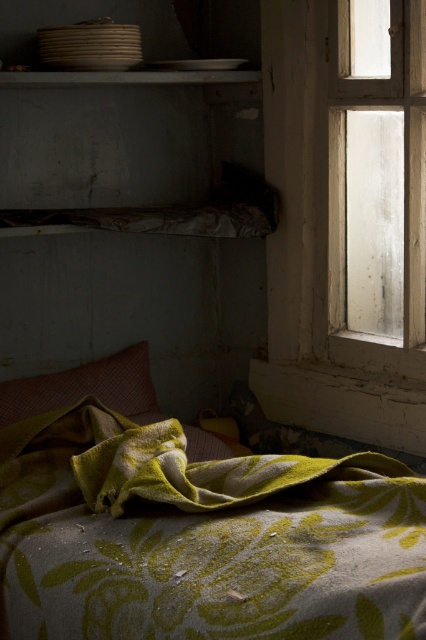
Is floral-patterned fabric at lower center to the right of red plaid pillow at center from the viewer's perspective?

Indeed, floral-patterned fabric at lower center is positioned on the right side of red plaid pillow at center.

From the picture: Is floral-patterned fabric at lower center thinner than red plaid pillow at center?

In fact, floral-patterned fabric at lower center might be wider than red plaid pillow at center.

Does point (356, 634) lie in front of point (40, 397)?

Yes, point (356, 634) is in front of point (40, 397).

The height and width of the screenshot is (640, 426). I want to click on floral-patterned fabric at lower center, so click(201, 538).

Looking at this image, does floral-patterned fabric at lower center appear under smooth white shelf at upper center?

Yes.

Which is below, floral-patterned fabric at lower center or smooth white shelf at upper center?

floral-patterned fabric at lower center is lower down.

Identify the location of floral-patterned fabric at lower center. (201, 538).

Find the location of a particular element. This screenshot has width=426, height=640. floral-patterned fabric at lower center is located at coordinates (201, 538).

Who is positioned more to the right, wooden frame window at right or red plaid pillow at center?

wooden frame window at right

Which is in front, point (422, 333) or point (109, 380)?

Point (422, 333)

This screenshot has height=640, width=426. Identify the location of wooden frame window at right. (371, 186).